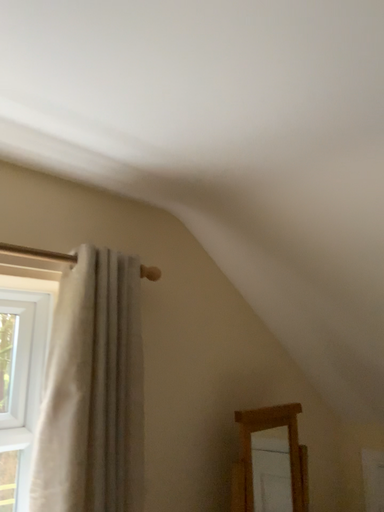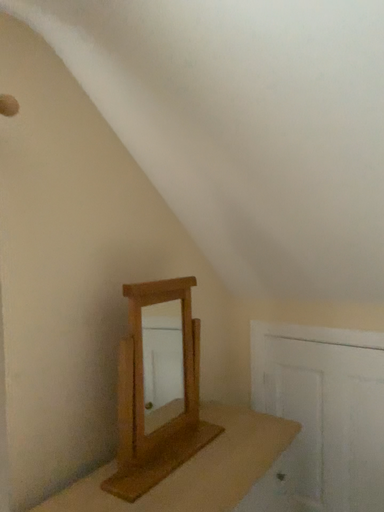
Question: Which way did the camera rotate in the video?

Choices:
 (A) rotated right
 (B) rotated left

Answer: (A)